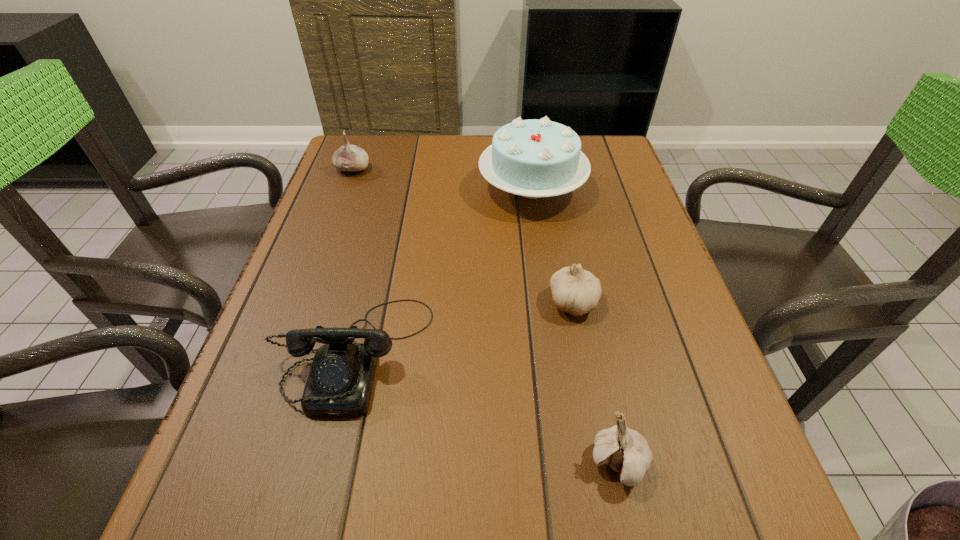
Locate an element on the screen. vacant space at the left edge of the desktop is located at coordinates (237, 430).

The image size is (960, 540). Identify the location of free space at the near right corner of the desktop. (740, 531).

Image resolution: width=960 pixels, height=540 pixels. In order to click on empty space between the telephone and the farthest garlic in this screenshot , I will do `click(353, 261)`.

Where is `free space that is in between the second farthest garlic and the nearest garlic`? The width and height of the screenshot is (960, 540). free space that is in between the second farthest garlic and the nearest garlic is located at coordinates tap(596, 382).

You are a GUI agent. You are given a task and a screenshot of the screen. Output one action in this format:
    pyautogui.click(x=<x>, y=<y>)
    Task: Click on the vacant region between the tallest object and the second nearest garlic
    This screenshot has height=540, width=960.
    Given the screenshot: What is the action you would take?
    pyautogui.click(x=553, y=245)

Image resolution: width=960 pixels, height=540 pixels. Find the location of `free point between the telephone and the tallest object`. free point between the telephone and the tallest object is located at coordinates (444, 270).

Find the location of a particular element. vacant point located between the farthest garlic and the tallest object is located at coordinates (x=443, y=178).

You are a GUI agent. You are given a task and a screenshot of the screen. Output one action in this format:
    pyautogui.click(x=<x>, y=<y>)
    Task: Click on the free space between the second farthest garlic and the farthest garlic
    The image size is (960, 540).
    Given the screenshot: What is the action you would take?
    pyautogui.click(x=464, y=235)

Find the location of a particular element. unoccupied area between the telephone and the birthday cake is located at coordinates (444, 270).

At what (x,y) coordinates should I click in order to perform the action: click on vacant space that's between the second nearest garlic and the tallest object. Please return your answer as a coordinate pair (x, y). The width and height of the screenshot is (960, 540). Looking at the image, I should click on (553, 245).